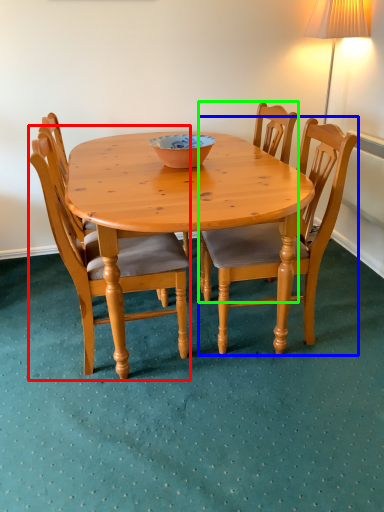
Question: Estimate the real-world distances between objects in this image. Which object is closer to chair (highlighted by a red box), chair (highlighted by a blue box) or chair (highlighted by a green box)?

Choices:
 (A) chair
 (B) chair

Answer: (B)